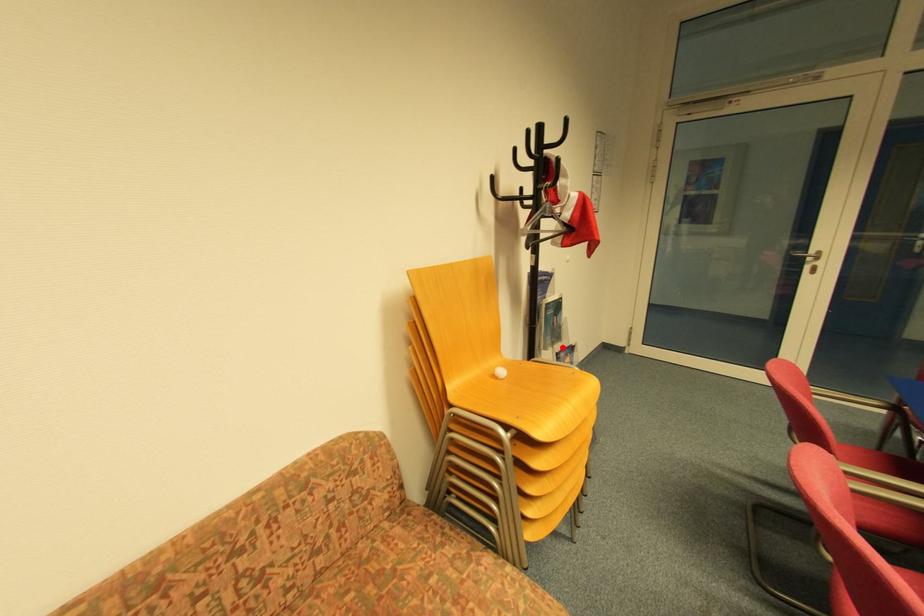
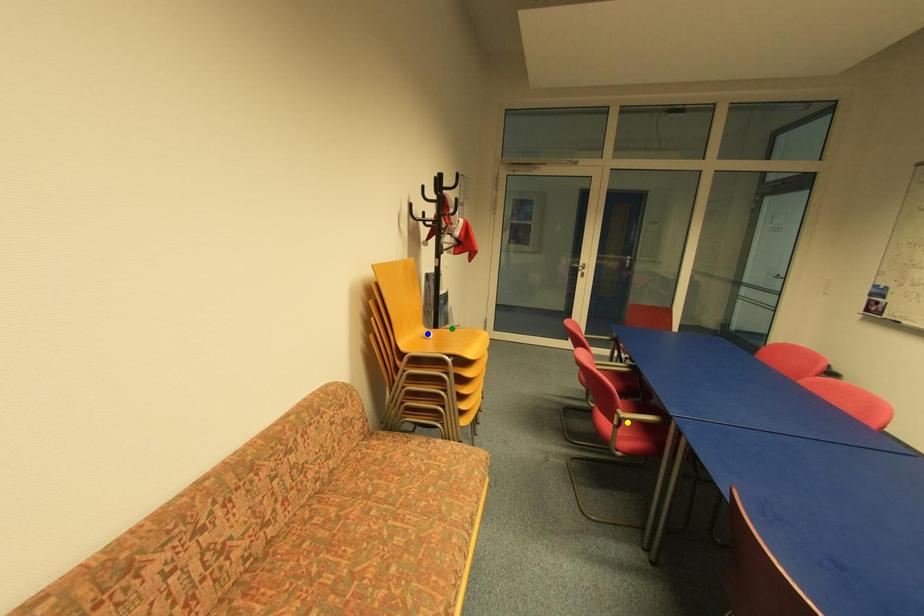
Question: I am providing you with two images of the same scene from different viewpoints. A red point is marked on the first image. You are given multiple points on the second image. Which spot in image 2 lines up with the point in image 1?

Choices:
 (A) blue point
 (B) green point
 (C) yellow point

Answer: (B)